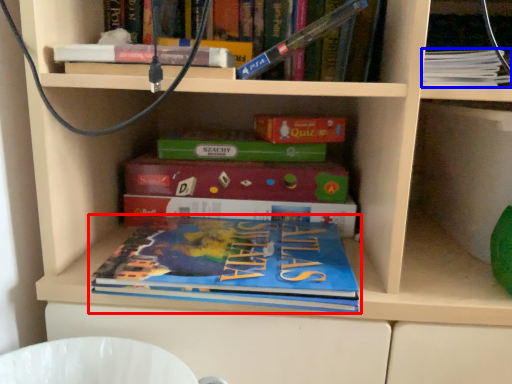
Question: Among these objects, which one is nearest to the camera, book (highlighted by a red box) or book (highlighted by a blue box)?

Choices:
 (A) book
 (B) book

Answer: (A)